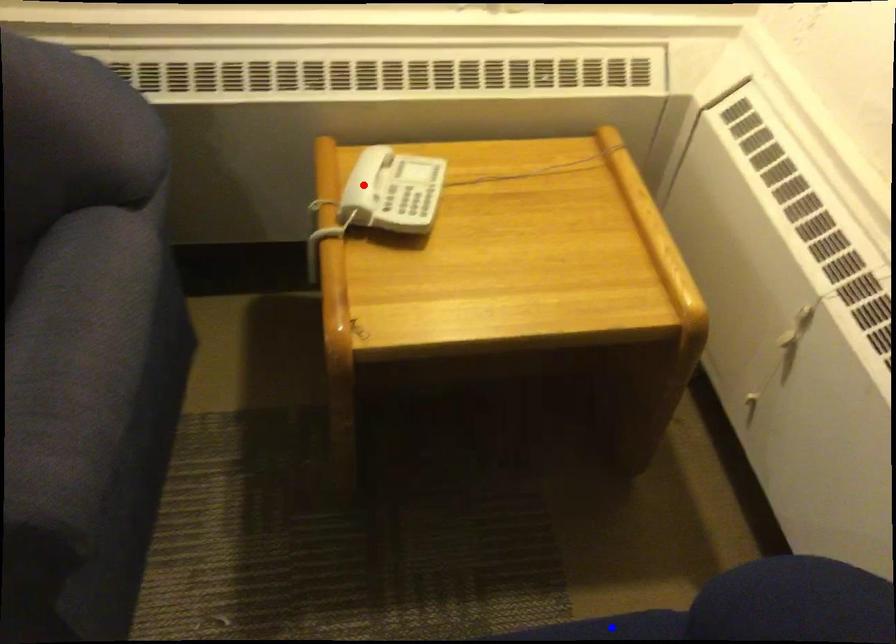
Question: In the image, two points are highlighted. Which point is nearer to the camera? Reply with the corresponding letter.

Choices:
 (A) blue point
 (B) red point

Answer: (A)